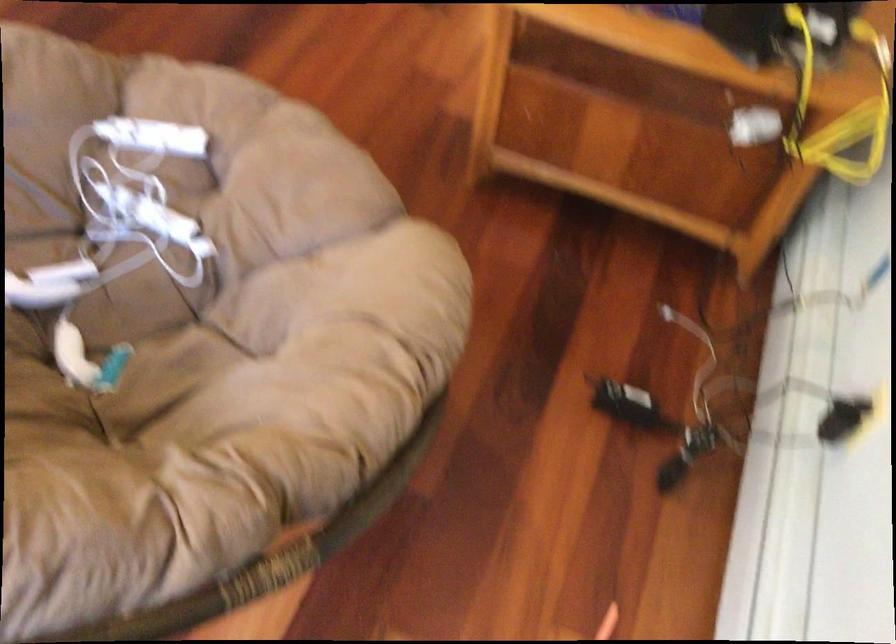
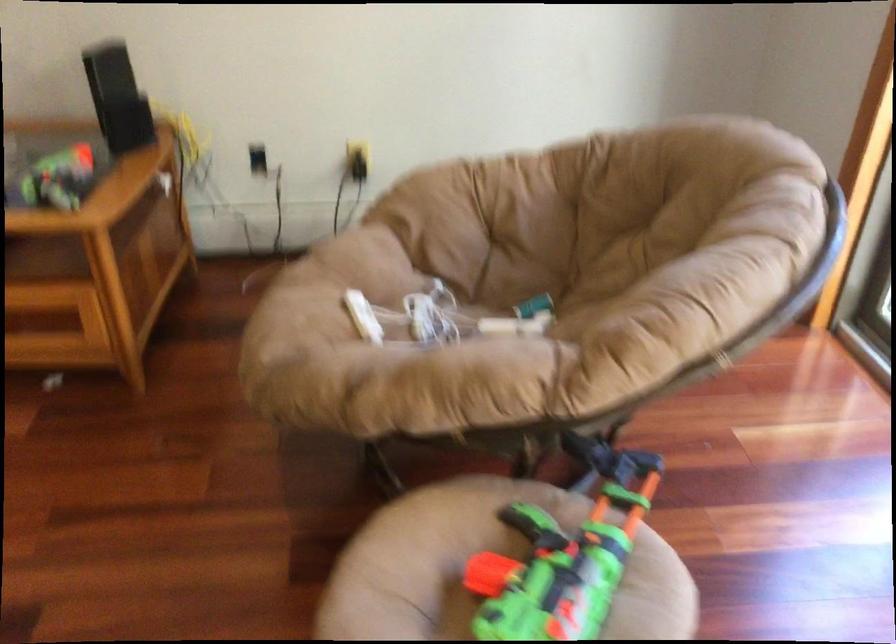
Locate, in the second image, the point that corresponds to point (154, 140) in the first image.

(363, 317)